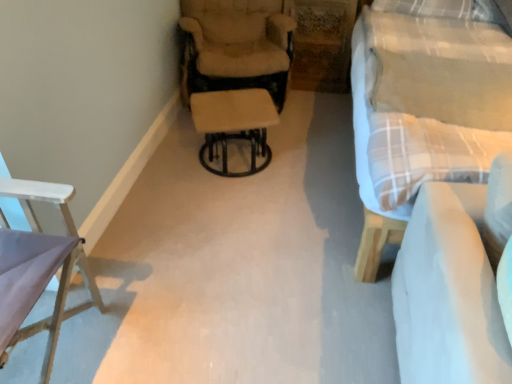
You are a GUI agent. You are given a task and a screenshot of the screen. Output one action in this format:
    pyautogui.click(x=<x>, y=<y>)
    Task: Click on the empty space that is to the right of black metal stool at center
    The height and width of the screenshot is (384, 512).
    Given the screenshot: What is the action you would take?
    pyautogui.click(x=306, y=163)